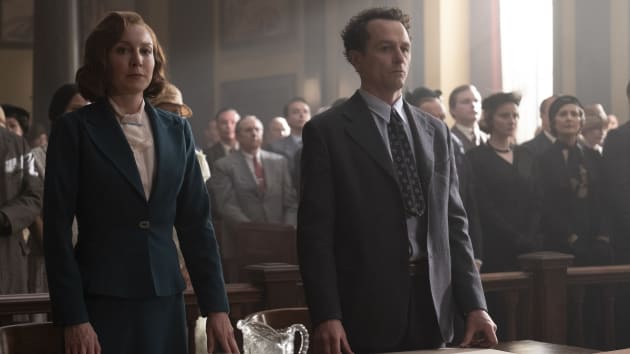
I want to click on courtroom, so click(x=306, y=80).